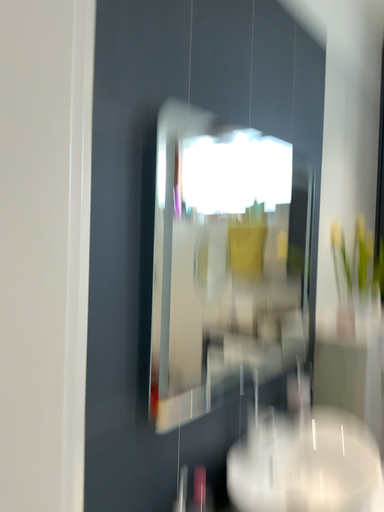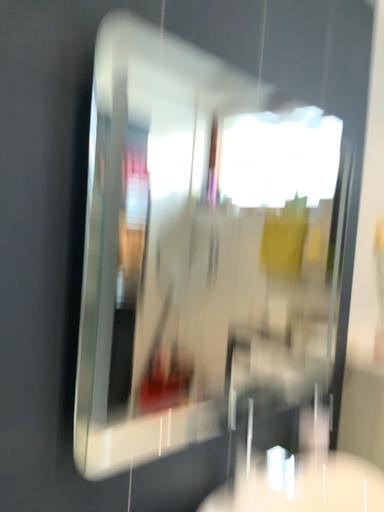
Question: How did the camera likely rotate when shooting the video?

Choices:
 (A) rotated left
 (B) rotated right

Answer: (A)